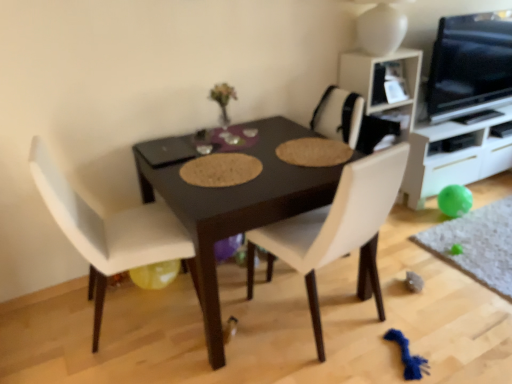
Locate an element on the screen. vacant area situated to the left side of yellow rubber balloon at lower left is located at coordinates (122, 295).